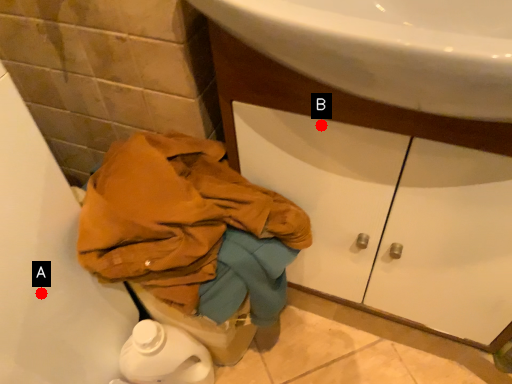
Question: Two points are circled on the image, labeled by A and B beside each circle. Which point appears closest to the camera in this image?

Choices:
 (A) A is closer
 (B) B is closer

Answer: (A)